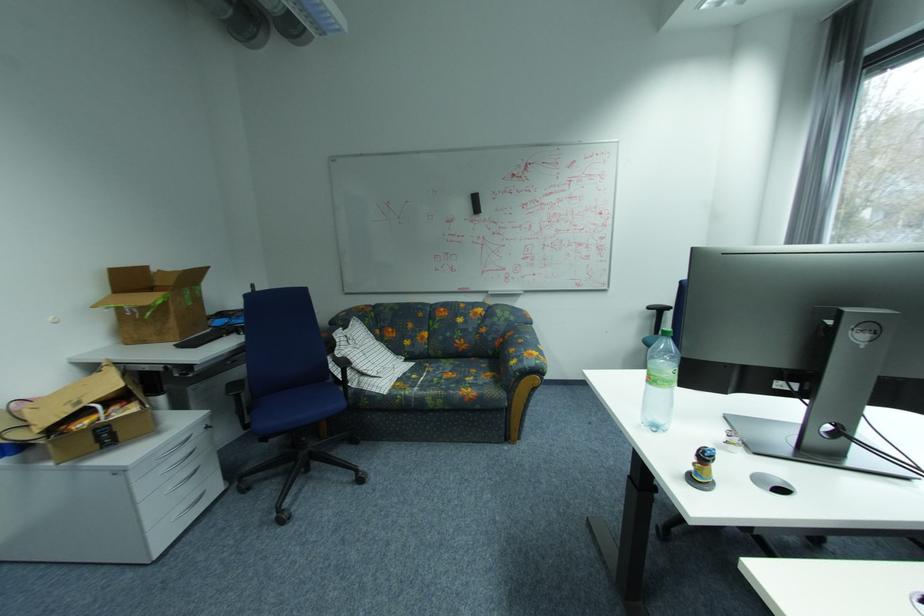
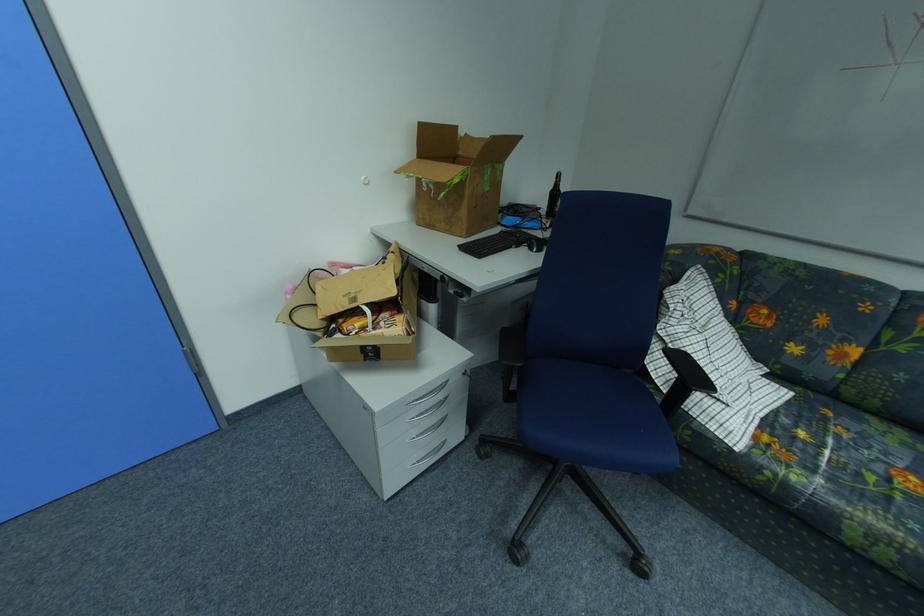
In the second image, find the point that corresponds to point 248,329 in the first image.

(541, 241)